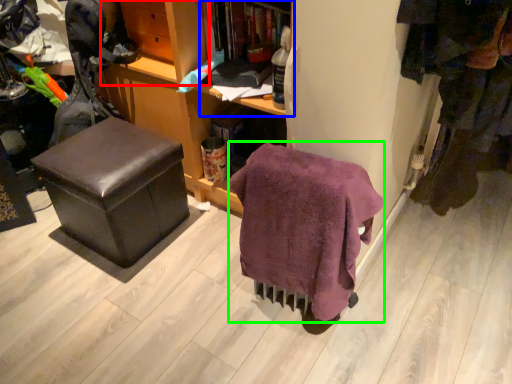
Question: Estimate the real-world distances between objects in this image. Which object is farther from shelf (highlighted by a red box), shelf (highlighted by a blue box) or blanket (highlighted by a green box)?

Choices:
 (A) shelf
 (B) blanket

Answer: (B)